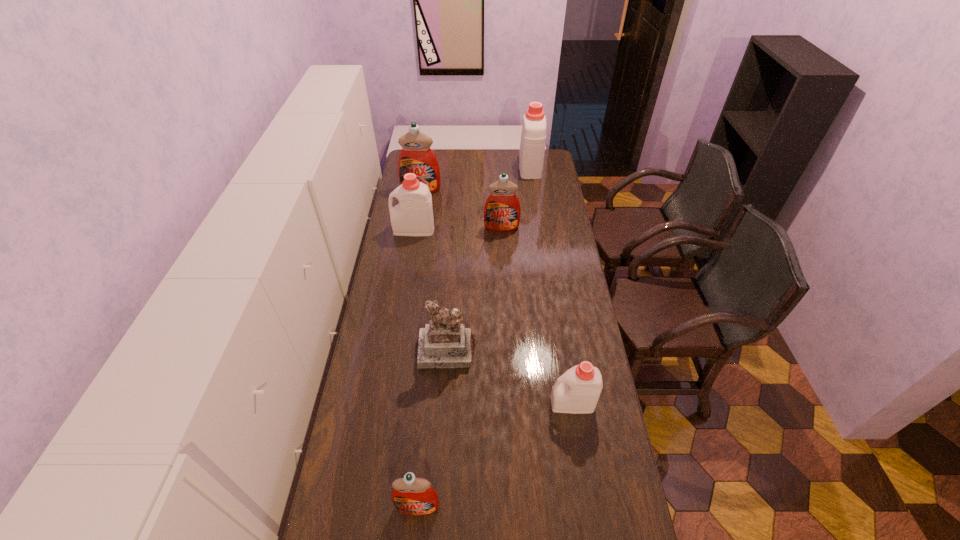
This screenshot has width=960, height=540. In order to click on unoccupied position between the figurine and the nearest red detergent in this screenshot , I will do `click(432, 429)`.

This screenshot has height=540, width=960. Identify the location of vacant area that lies between the second nearest detergent and the fifth farthest object. [510, 377].

Identify the location of vacant space that is in between the nearest red detergent and the second biggest white detergent. The height and width of the screenshot is (540, 960). (416, 368).

I want to click on vacant area between the third nearest object and the sixth farthest object, so (510, 377).

Where is `object that ranks as the sixth closest to the nearest red detergent`? The width and height of the screenshot is (960, 540). object that ranks as the sixth closest to the nearest red detergent is located at coordinates (533, 136).

Locate an element on the screen. the sixth closest object to the fifth farthest object is located at coordinates (533, 136).

I want to click on detergent that is the fourth closest to the farthest red detergent, so click(x=577, y=391).

Locate which detergent ranks in proximity to the farthest detergent. Please provide its 2D coordinates. Your answer should be formatted as a tuple, i.e. [(x, y)], where the tuple contains the x and y coordinates of a point satisfying the conditions above.

[(502, 210)]

Identify which white detergent is the closest to the farthest object. Please provide its 2D coordinates. Your answer should be formatted as a tuple, i.e. [(x, y)], where the tuple contains the x and y coordinates of a point satisfying the conditions above.

[(413, 216)]

At what (x,y) coordinates should I click in order to perform the action: click on white detergent identified as the closest to the farthest white detergent. Please return your answer as a coordinate pair (x, y). This screenshot has height=540, width=960. Looking at the image, I should click on (413, 216).